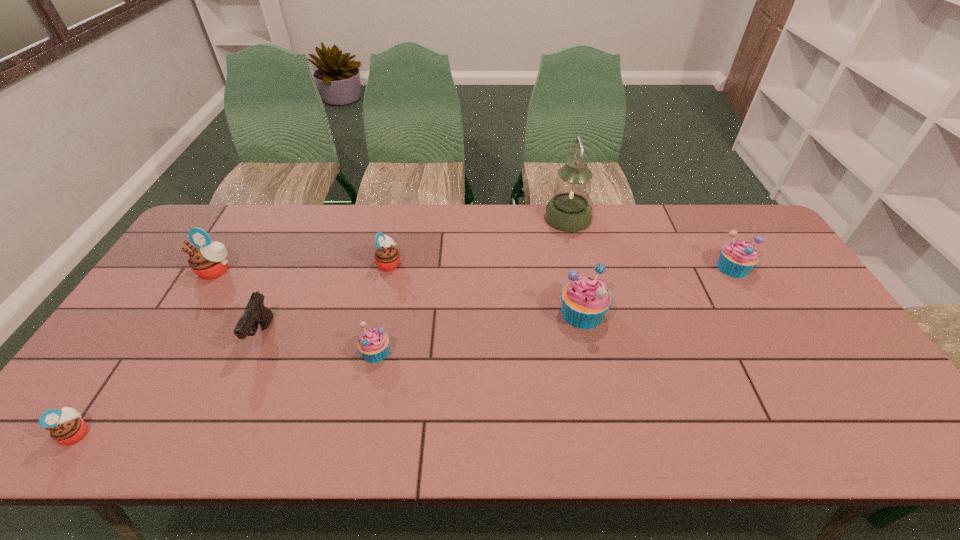
In the image, there is a desktop. Identify the location of vacant space at the right edge. This screenshot has width=960, height=540. (803, 350).

Image resolution: width=960 pixels, height=540 pixels. Find the location of `vacant space at the near right corner of the desktop`. vacant space at the near right corner of the desktop is located at coordinates (846, 426).

Image resolution: width=960 pixels, height=540 pixels. What are the coordinates of `empty location between the biggest pink muffin and the second biggest pink muffin` in the screenshot? It's located at (302, 267).

Find the location of a particular element. The height and width of the screenshot is (540, 960). vacant area that lies between the smallest blue muffin and the tallest object is located at coordinates (471, 285).

Identify the location of free space that is in between the leftmost pink muffin and the rightmost pink muffin. The height and width of the screenshot is (540, 960). (233, 348).

I want to click on unoccupied area between the nearest blue muffin and the pistol, so click(319, 343).

Identify the location of free space between the smallest blue muffin and the pistol. This screenshot has height=540, width=960. (319, 343).

Find the location of a particular element. Image resolution: width=960 pixels, height=540 pixels. free space between the black pistol and the second biggest pink muffin is located at coordinates (325, 299).

This screenshot has height=540, width=960. Find the location of `vacant area between the rightmost pink muffin and the pistol`. vacant area between the rightmost pink muffin and the pistol is located at coordinates (325, 299).

This screenshot has height=540, width=960. I want to click on vacant space in between the tallest object and the pistol, so click(x=415, y=276).